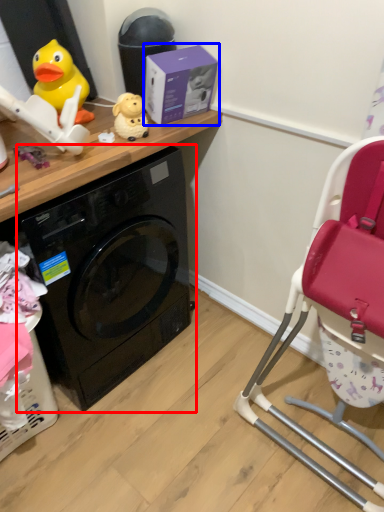
Question: Which point is further to the camera, washing machine (highlighted by a red box) or box (highlighted by a blue box)?

Choices:
 (A) washing machine
 (B) box

Answer: (B)